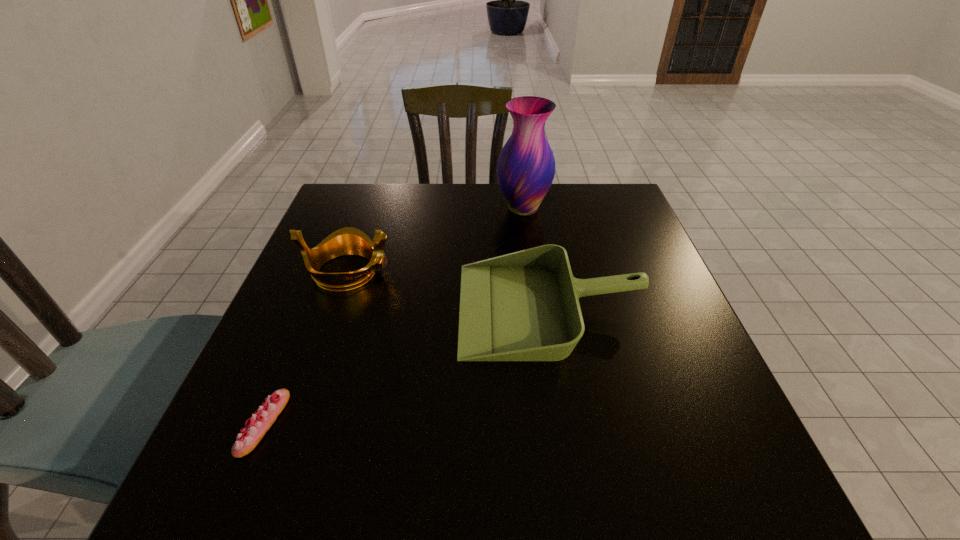
Locate an element on the screen. free space located on the scoop of the dustpan is located at coordinates (375, 308).

Where is `free region located on the right of the shortest object`? The width and height of the screenshot is (960, 540). free region located on the right of the shortest object is located at coordinates (353, 423).

This screenshot has height=540, width=960. I want to click on object positioned at the far edge, so click(x=526, y=166).

Locate an element on the screen. object at the near edge is located at coordinates coord(260,422).

Locate an element on the screen. tiara situated at the left edge is located at coordinates (346, 241).

Where is `eclair that is positioned at the left edge`? eclair that is positioned at the left edge is located at coordinates [x=260, y=422].

The image size is (960, 540). I want to click on object present at the right edge, so click(523, 306).

Locate an element on the screen. Image resolution: width=960 pixels, height=540 pixels. object that is at the near left corner is located at coordinates (260, 422).

Identify the location of vacant space at the far edge of the desktop. (461, 192).

In the image, there is a desktop. Where is `free space at the near edge`? free space at the near edge is located at coordinates (574, 469).